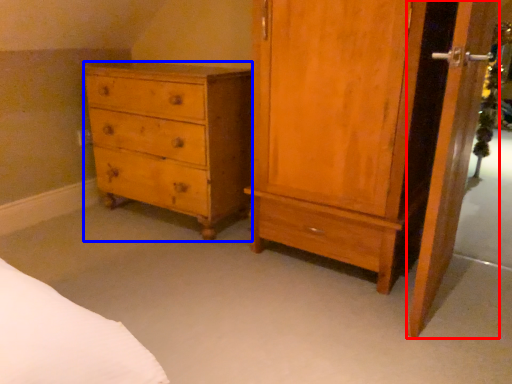
Question: Which object appears closest to the camera in this image, screen door (highlighted by a red box) or chest of drawers (highlighted by a blue box)?

Choices:
 (A) screen door
 (B) chest of drawers

Answer: (A)